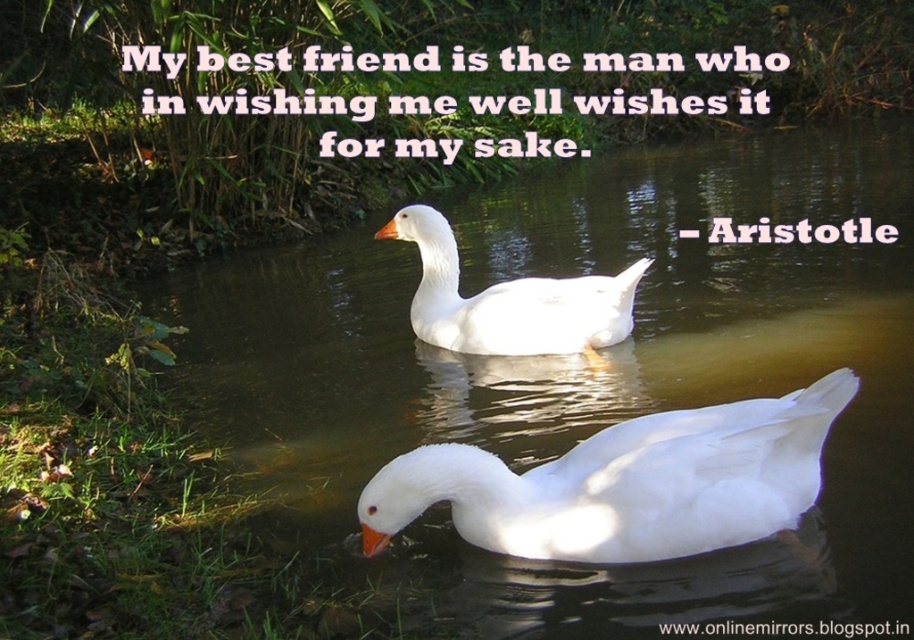
You are a photographer trying to capture a closeup of the white matte duck at center. Based on the scene, will the clear water at center appear in front of or behind the duck in your photo?

The clear water at center is closer to the viewer than the white matte duck at center, so the water will appear in front of the duck in the photo.

Looking at this image, you are a photographer trying to capture both the white matte swan at lower center and the white matte duck at center in a single frame. Based on their sizes, which one would appear larger in the photo?

The white matte duck at center would appear larger in the photo because it is bigger than the white matte swan at lower center.

You are a photographer aiming to capture the white matte swan at lower center in your shot. However, there is clear water at center in the way. Can you adjust your angle to see the swan clearly without moving the water?

The clear water at center is positioned over the white matte swan at lower center, so adjusting your angle might allow you to see the swan through the water, but the water may obscure the view slightly depending on clarity.